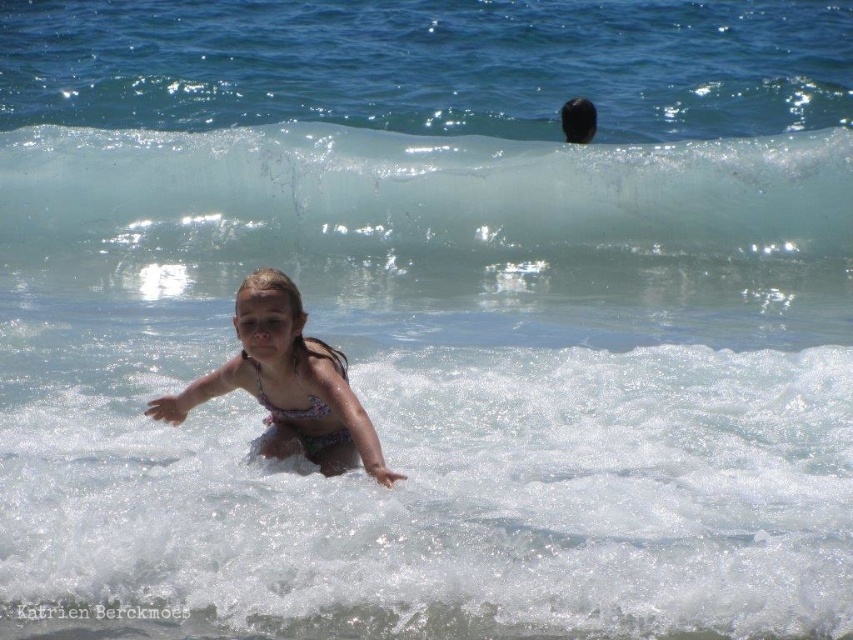
You are a photographer trying to capture the perfect shot of the clear glass wave at upper center and the multicolored bikini at center. To ensure both are in frame, should you position your camera to the left or right of the scene?

Since the clear glass wave at upper center is to the right of the multicolored bikini at center, you should position your camera to the left of the scene to ensure both are in frame.

From the picture: You are a photographer at the beach scene. You want to capture the clear glass wave at upper center in your shot. Where should you position your camera relative to the point marked by coordinates (x=425, y=189) to ensure the wave is centered in your photo?

The point marked by coordinates (x=425, y=189) already marks the clear glass wave at upper center, so positioning the camera directly facing this point will center the wave in the photo.